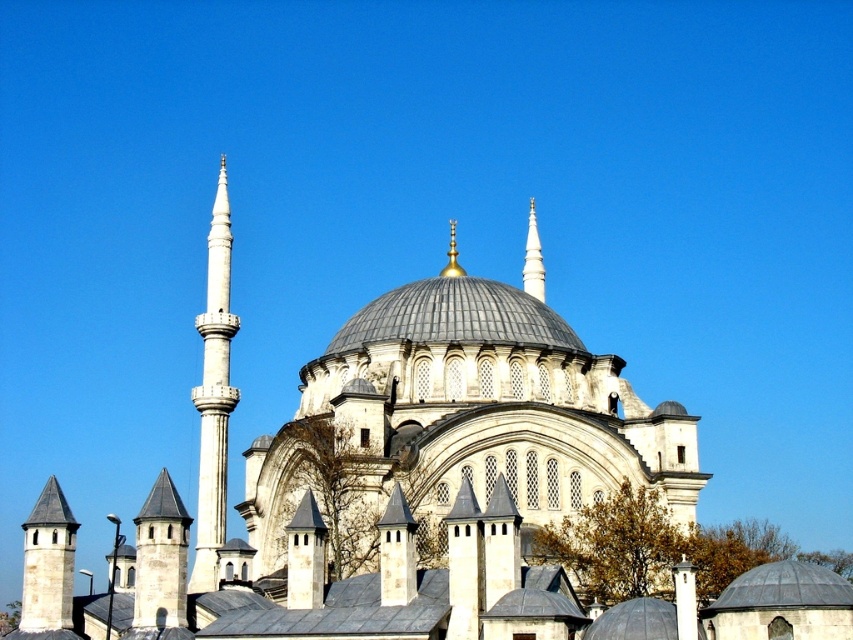
You are a drone operator tasked with capturing aerial footage of the grand mosque. Your drone has a maximum flight range of 100 meters. If you are positioned at the camera location, can your drone reach the white marble spire at center?

The distance between the white marble spire at center and the camera is 101.90 meters, which exceeds the drone maximum flight range of 100 meters. Therefore, the drone cannot reach the white marble spire at center.

You are standing in front of the grand mosque and want to locate the white stone minaret at lower left. Based on its coordinates, where should you look relative to the main entrance?

The white stone minaret at lower left is located at coordinates point [48,566], which means it is positioned at the lower left corner of the mosque, likely near the entrance area. Since coordinates typically start from the bottom left corner of an image, this minaret is close to the lower left edge, making it easy to spot when facing the main entrance.